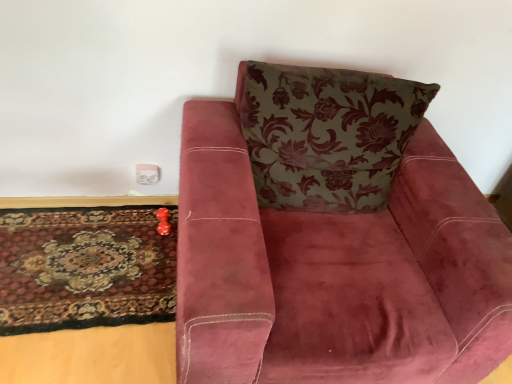
Describe the element at coordinates (327, 135) in the screenshot. This screenshot has height=384, width=512. I see `floral-patterned fabric pillow at upper center` at that location.

Locate an element on the screen. Image resolution: width=512 pixels, height=384 pixels. white plastic electric outlet at lower left is located at coordinates (147, 174).

Locate an element on the screen. The image size is (512, 384). floral-patterned fabric pillow at upper center is located at coordinates (327, 135).

Is point (394, 155) closer or farther from the camera than point (31, 227)?

Clearly, point (394, 155) is closer to the camera than point (31, 227).

What's the angular difference between floral-patterned fabric pillow at upper center and carpeted rug at lower left's facing directions?

The angle between the facing direction of floral-patterned fabric pillow at upper center and the facing direction of carpeted rug at lower left is 3.13 degrees.

From a real-world perspective, between floral-patterned fabric pillow at upper center and carpeted rug at lower left, who is vertically lower?

carpeted rug at lower left.

Is white plastic electric outlet at lower left located within velvet maroon armchair at center?

No, white plastic electric outlet at lower left is not inside velvet maroon armchair at center.

Between velvet maroon armchair at center and white plastic electric outlet at lower left, which one appears on the left side from the viewer's perspective?

white plastic electric outlet at lower left is more to the left.

From the image's perspective, which one is positioned lower, velvet maroon armchair at center or white plastic electric outlet at lower left?

velvet maroon armchair at center appears lower in the image.

Looking at this image, considering the sizes of velvet maroon armchair at center and white plastic electric outlet at lower left in the image, is velvet maroon armchair at center bigger or smaller than white plastic electric outlet at lower left?

Clearly, velvet maroon armchair at center is larger in size than white plastic electric outlet at lower left.

Is the position of velvet maroon armchair at center more distant than that of floral-patterned fabric pillow at upper center?

No, velvet maroon armchair at center is closer to the viewer.

Is velvet maroon armchair at center shorter than floral-patterned fabric pillow at upper center?

In fact, velvet maroon armchair at center may be taller than floral-patterned fabric pillow at upper center.

Is velvet maroon armchair at center facing away from floral-patterned fabric pillow at upper center?

Absolutely, velvet maroon armchair at center is directed away from floral-patterned fabric pillow at upper center.

Identify the location of throw pillow above the velvet maroon armchair at center (from a real-world perspective). The image size is (512, 384). (327, 135).

Is white plastic electric outlet at lower left not close to floral-patterned fabric pillow at upper center?

Actually, white plastic electric outlet at lower left and floral-patterned fabric pillow at upper center are a little close together.

From a real-world perspective, is white plastic electric outlet at lower left positioned over floral-patterned fabric pillow at upper center based on gravity?

No.

In terms of height, does white plastic electric outlet at lower left look taller or shorter compared to floral-patterned fabric pillow at upper center?

Clearly, white plastic electric outlet at lower left is shorter compared to floral-patterned fabric pillow at upper center.

Between point (146, 182) and point (376, 103), which one is positioned in front?

The point (376, 103) is closer.

Considering the relative positions of white plastic electric outlet at lower left and carpeted rug at lower left in the image provided, is white plastic electric outlet at lower left in front of carpeted rug at lower left?

No, white plastic electric outlet at lower left is behind carpeted rug at lower left.

Considering the sizes of objects white plastic electric outlet at lower left and carpeted rug at lower left in the image provided, who is bigger, white plastic electric outlet at lower left or carpeted rug at lower left?

carpeted rug at lower left.

Find the location of a particular element. mat on the left of white plastic electric outlet at lower left is located at coordinates (85, 268).

Is velvet maroon armchair at center with carpeted rug at lower left?

No, velvet maroon armchair at center is not touching carpeted rug at lower left.

Between velvet maroon armchair at center and carpeted rug at lower left, which one appears on the left side from the viewer's perspective?

carpeted rug at lower left.

From a real-world perspective, is velvet maroon armchair at center located beneath carpeted rug at lower left?

No, from a real-world perspective, velvet maroon armchair at center is not beneath carpeted rug at lower left.

Measure the distance from velvet maroon armchair at center to carpeted rug at lower left.

velvet maroon armchair at center is 27.90 inches away from carpeted rug at lower left.

Which is closer, (x=12, y=230) or (x=252, y=104)?

Positioned in front is point (x=252, y=104).

Is carpeted rug at lower left to the right of floral-patterned fabric pillow at upper center from the viewer's perspective?

No.

From the image's perspective, does carpeted rug at lower left appear higher than floral-patterned fabric pillow at upper center?

No, from the image's perspective, carpeted rug at lower left is not above floral-patterned fabric pillow at upper center.

Considering their positions, is carpeted rug at lower left located in front of or behind floral-patterned fabric pillow at upper center?

Visually, carpeted rug at lower left is located behind floral-patterned fabric pillow at upper center.

Where is `mat that appears on the left of floral-patterned fabric pillow at upper center`? mat that appears on the left of floral-patterned fabric pillow at upper center is located at coordinates (85, 268).

Locate an element on the screen. electric outlet directly beneath the velvet maroon armchair at center (from a real-world perspective) is located at coordinates (147, 174).

When comparing their distances from velvet maroon armchair at center, does white plastic electric outlet at lower left or carpeted rug at lower left seem further?

white plastic electric outlet at lower left.

Considering their positions, is floral-patterned fabric pillow at upper center positioned closer to velvet maroon armchair at center than white plastic electric outlet at lower left?

floral-patterned fabric pillow at upper center is positioned closer to the anchor velvet maroon armchair at center.

When comparing their distances from floral-patterned fabric pillow at upper center, does carpeted rug at lower left or velvet maroon armchair at center seem closer?

Based on the image, velvet maroon armchair at center appears to be nearer to floral-patterned fabric pillow at upper center.

From the image, which object appears to be farther from floral-patterned fabric pillow at upper center, white plastic electric outlet at lower left or carpeted rug at lower left?

white plastic electric outlet at lower left lies further to floral-patterned fabric pillow at upper center than the other object.

Looking at the image, which one is located further to floral-patterned fabric pillow at upper center, white plastic electric outlet at lower left or velvet maroon armchair at center?

white plastic electric outlet at lower left is further to floral-patterned fabric pillow at upper center.

Which object lies further to the anchor point white plastic electric outlet at lower left, carpeted rug at lower left or floral-patterned fabric pillow at upper center?

The object further to white plastic electric outlet at lower left is floral-patterned fabric pillow at upper center.

Which object lies further to the anchor point white plastic electric outlet at lower left, floral-patterned fabric pillow at upper center or velvet maroon armchair at center?

velvet maroon armchair at center is positioned further to the anchor white plastic electric outlet at lower left.

When comparing their distances from velvet maroon armchair at center, does floral-patterned fabric pillow at upper center or carpeted rug at lower left seem further?

carpeted rug at lower left is further to velvet maroon armchair at center.

Where is `mat between velvet maroon armchair at center and white plastic electric outlet at lower left from front to back`? mat between velvet maroon armchair at center and white plastic electric outlet at lower left from front to back is located at coordinates (85, 268).

Where is `throw pillow between velvet maroon armchair at center and white plastic electric outlet at lower left in the front-back direction`? This screenshot has height=384, width=512. throw pillow between velvet maroon armchair at center and white plastic electric outlet at lower left in the front-back direction is located at coordinates (327, 135).

Locate an element on the screen. The height and width of the screenshot is (384, 512). electric outlet located between carpeted rug at lower left and floral-patterned fabric pillow at upper center in the left-right direction is located at coordinates (147, 174).

This screenshot has height=384, width=512. I want to click on chair between carpeted rug at lower left and floral-patterned fabric pillow at upper center in the horizontal direction, so click(x=335, y=271).